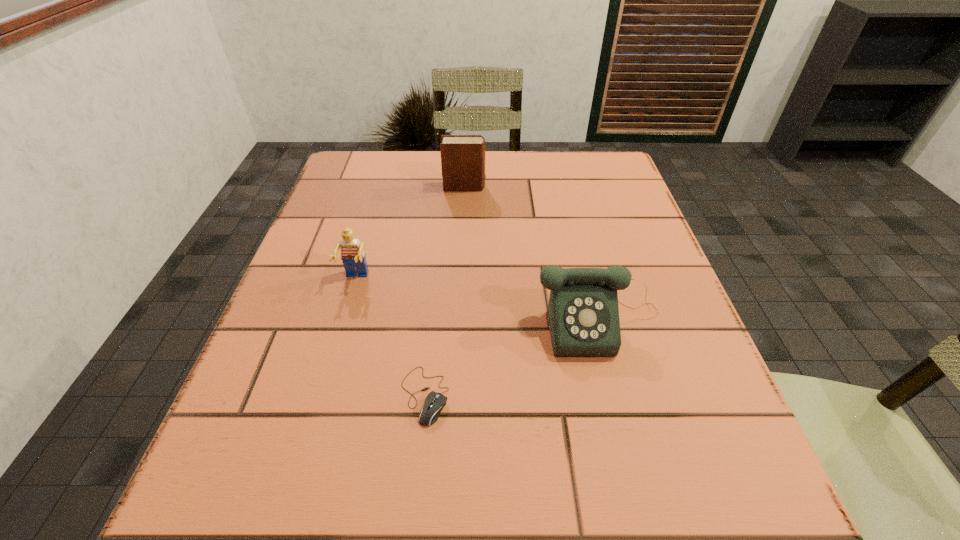
Where is `the farthest object`? This screenshot has width=960, height=540. the farthest object is located at coordinates (462, 156).

Find the location of a particular element. The height and width of the screenshot is (540, 960). telephone is located at coordinates (583, 313).

Where is `the rightmost object`? This screenshot has width=960, height=540. the rightmost object is located at coordinates (583, 313).

Locate an element on the screen. the leftmost object is located at coordinates (353, 257).

Locate an element on the screen. The height and width of the screenshot is (540, 960). the third nearest object is located at coordinates (353, 257).

Locate an element on the screen. The height and width of the screenshot is (540, 960). the shortest object is located at coordinates (434, 403).

Find the location of a particular element. Image resolution: width=960 pixels, height=540 pixels. the nearest object is located at coordinates (434, 403).

Identify the location of vacant point located 0.240m on the spine side of the farthest object. (579, 187).

This screenshot has width=960, height=540. I want to click on free space located on the dial of the telephone, so click(x=632, y=449).

Find the location of a particular element. Image resolution: width=960 pixels, height=540 pixels. free space located on the face of the second farthest object is located at coordinates (298, 482).